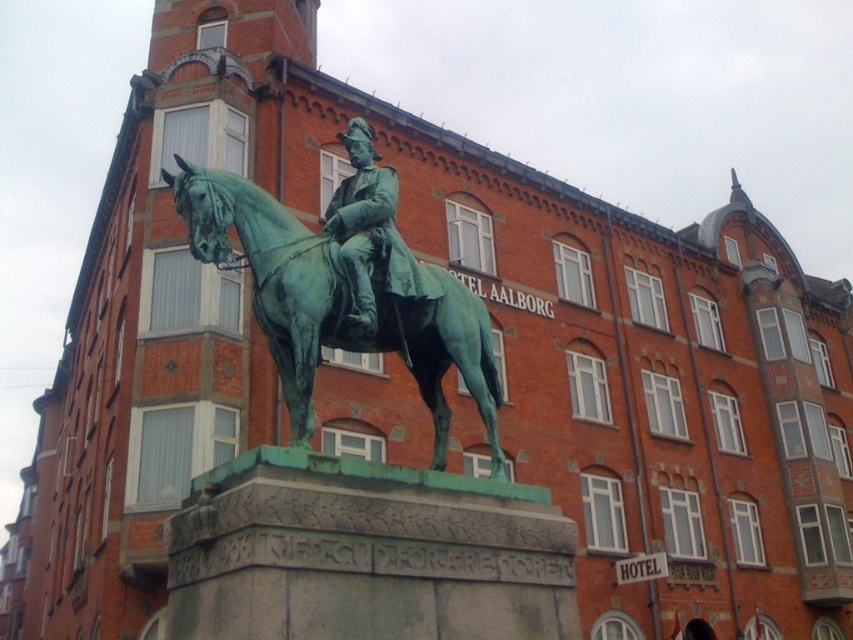
Is green patina horse at center taller than green patina bronze statue at center?

No, green patina horse at center is not taller than green patina bronze statue at center.

Which is above, green patina horse at center or green patina bronze statue at center?

Positioned higher is green patina bronze statue at center.

Is point (436, 358) farther from viewer compared to point (351, 189)?

Yes, it is behind point (351, 189).

This screenshot has height=640, width=853. Find the location of `green patina horse at center`. green patina horse at center is located at coordinates (338, 305).